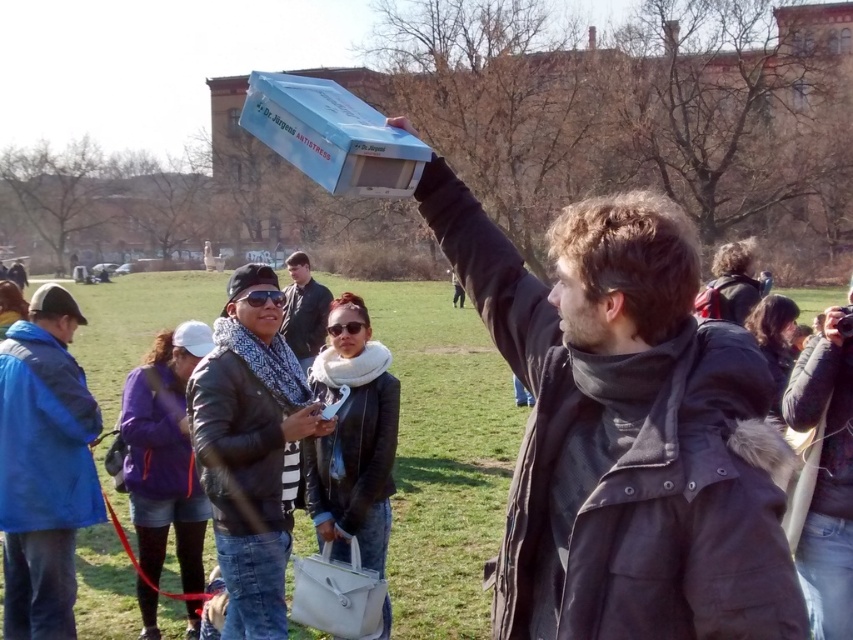
I want to click on blue fabric jacket at lower left, so click(44, 467).

Based on the photo, is blue fabric jacket at lower left thinner than leather jacket at center?

Correct, blue fabric jacket at lower left's width is less than leather jacket at center's.

Who is more distant from viewer, (80, 433) or (289, 321)?

The point (289, 321) is behind.

Identify the location of blue fabric jacket at lower left. (44, 467).

Does matte black jacket at center appear over blue fabric jacket at lower left?

Yes.

Does matte black jacket at center lie behind blue fabric jacket at lower left?

No.

I want to click on matte black jacket at center, so click(x=625, y=429).

Is point (561, 284) positioned in front of point (287, 518)?

Yes, it is in front of point (287, 518).

The image size is (853, 640). Describe the element at coordinates (625, 429) in the screenshot. I see `matte black jacket at center` at that location.

Is point (517, 342) less distant than point (233, 413)?

Yes, it is.

Identify the location of matte black jacket at center. Image resolution: width=853 pixels, height=640 pixels. (625, 429).